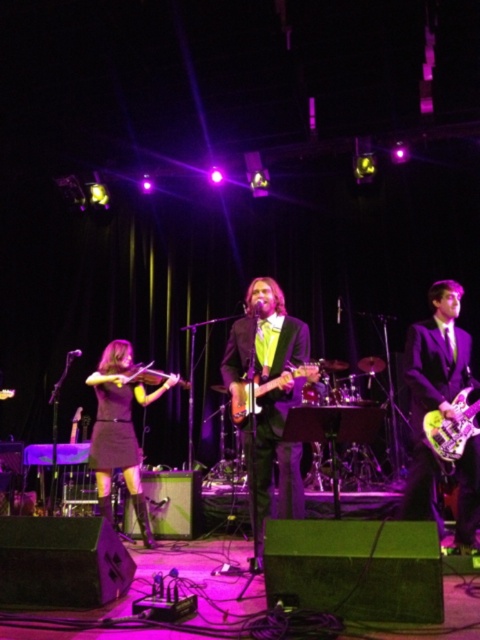
Between matte black violin at left and shiny purple electric guitar at right, which one appears on the right side from the viewer's perspective?

From the viewer's perspective, shiny purple electric guitar at right appears more on the right side.

Does point (116, 396) come closer to viewer compared to point (425, 413)?

No.

This screenshot has width=480, height=640. In order to click on matte black violin at left in this screenshot , I will do `click(120, 429)`.

You are a GUI agent. You are given a task and a screenshot of the screen. Output one action in this format:
    pyautogui.click(x=<x>, y=<y>)
    Task: Click on the shiny black suit at center
    This screenshot has height=640, width=480.
    Given the screenshot: What is the action you would take?
    268,396

Does point (260, 460) come in front of point (471, 413)?

That is False.

Where is `shiny black suit at center`? The image size is (480, 640). shiny black suit at center is located at coordinates (268, 396).

In the scene shown: Can you confirm if purple glossy guitar at center is taller than matte black violin at left?

Yes, purple glossy guitar at center is taller than matte black violin at left.

Is purple glossy guitar at center further to camera compared to matte black violin at left?

No.

Is point (474, 452) positioned behind point (101, 480)?

No.

This screenshot has width=480, height=640. What are the coordinates of `purple glossy guitar at center` in the screenshot? It's located at (433, 388).